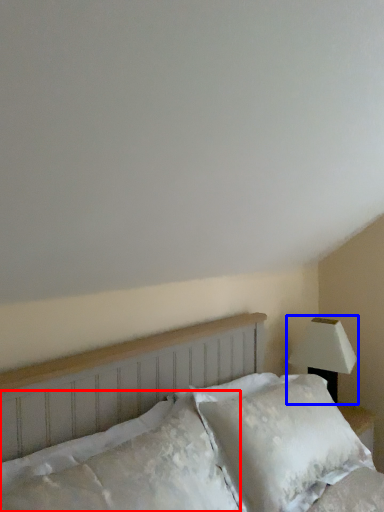
Question: Which object is further to the camera taking this photo, pillow (highlighted by a red box) or lamp (highlighted by a blue box)?

Choices:
 (A) pillow
 (B) lamp

Answer: (B)